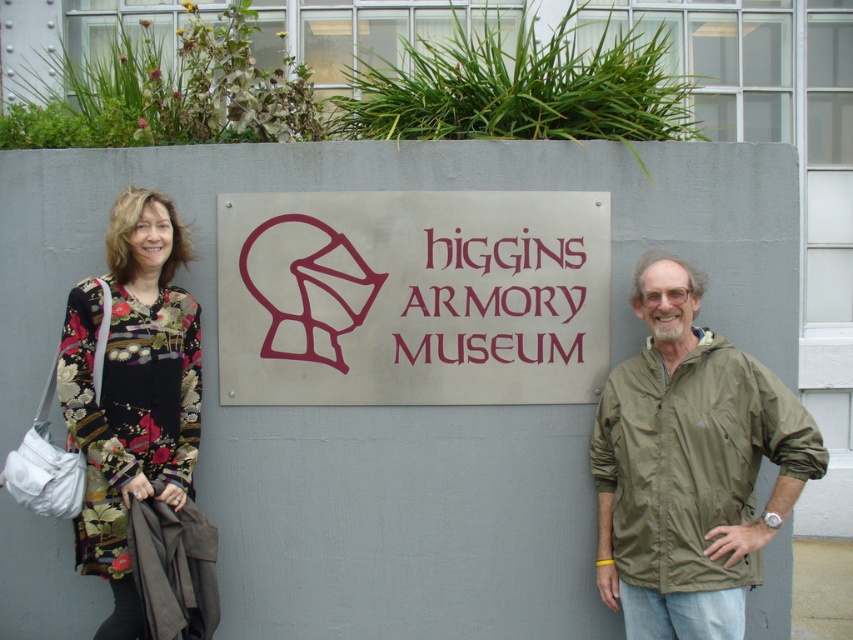
You are a photographer trying to capture both the olive green jacket at right and the matte metal sign at center in a single frame. Based on their sizes, which object should you focus on first to ensure both are in focus?

The olive green jacket at right has a greater height compared to the matte metal sign at center, so you should focus on the olive green jacket at right first to ensure both are in focus since it is larger and requires more attention.